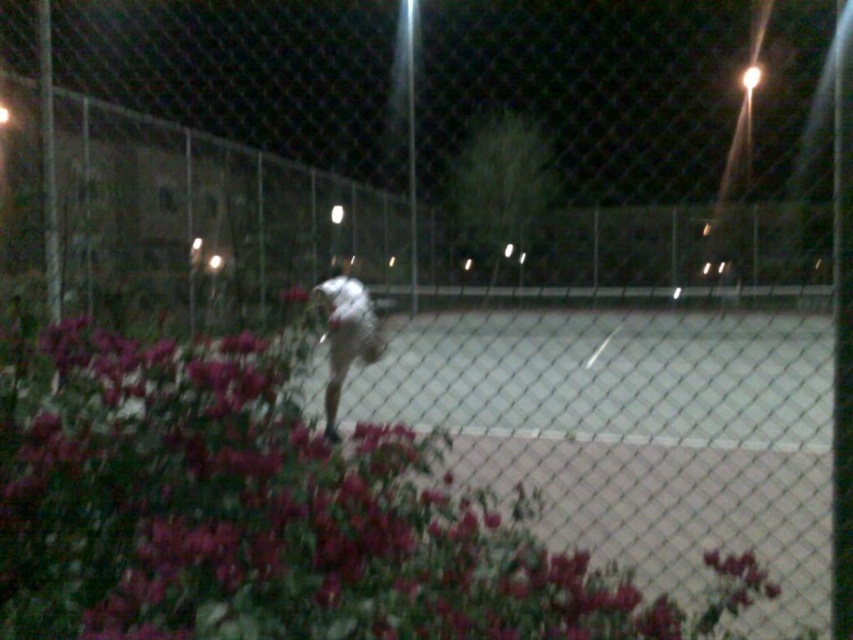
Question: Which point appears farthest from the camera in this image?

Choices:
 (A) (360, 296)
 (B) (25, 600)

Answer: (A)

Question: Can you confirm if purple matte flowers at center is bigger than white fabric shirt at center?

Choices:
 (A) no
 (B) yes

Answer: (B)

Question: Observing the image, what is the correct spatial positioning of purple matte flowers at center in reference to white fabric shirt at center?

Choices:
 (A) above
 (B) below

Answer: (B)

Question: Which of the following is the closest to the observer?

Choices:
 (A) white fabric shirt at center
 (B) purple matte flowers at center

Answer: (B)

Question: Can you confirm if purple matte flowers at center is thinner than white fabric shirt at center?

Choices:
 (A) yes
 (B) no

Answer: (B)